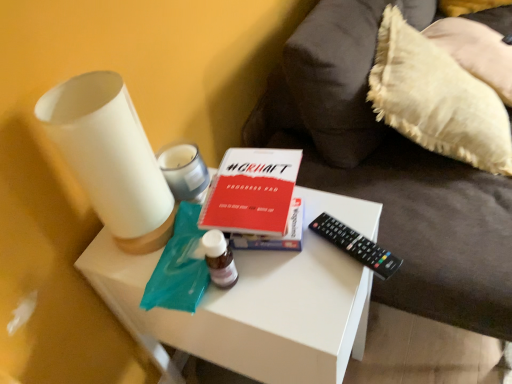
Question: Does white matte vase at left, the second candle holder positioned from the back, have a greater height compared to white fluffy pillow at right?

Choices:
 (A) no
 (B) yes

Answer: (A)

Question: Is white fluffy pillow at right at the back of white matte vase at left, the second candle holder positioned from the back?

Choices:
 (A) no
 (B) yes

Answer: (A)

Question: From a real-world perspective, is white matte vase at left, positioned as the first candle holder in front-to-back order, physically above white fluffy pillow at right?

Choices:
 (A) no
 (B) yes

Answer: (B)

Question: From the image's perspective, does white matte vase at left, the second candle holder positioned from the back, appear lower than white fluffy pillow at right?

Choices:
 (A) no
 (B) yes

Answer: (B)

Question: Is white fluffy pillow at right located within white matte vase at left, positioned as the first candle holder in front-to-back order?

Choices:
 (A) no
 (B) yes

Answer: (A)

Question: Looking at their shapes, would you say white matte table at center is wider or thinner than white fluffy pillow at right?

Choices:
 (A) wide
 (B) thin

Answer: (A)

Question: Does point (182, 339) appear closer or farther from the camera than point (467, 122)?

Choices:
 (A) farther
 (B) closer

Answer: (B)

Question: Is white matte table at center in front of or behind white fluffy pillow at right in the image?

Choices:
 (A) behind
 (B) front

Answer: (B)

Question: Do you think white matte table at center is within white fluffy pillow at right, or outside of it?

Choices:
 (A) outside
 (B) inside

Answer: (A)

Question: Do you think black plastic remote at right is within white matte side table at center, or outside of it?

Choices:
 (A) inside
 (B) outside

Answer: (B)

Question: Is black plastic remote at right in front of or behind white matte side table at center in the image?

Choices:
 (A) front
 (B) behind

Answer: (B)

Question: From the image's perspective, relative to white matte side table at center, is black plastic remote at right above or below?

Choices:
 (A) below
 (B) above

Answer: (A)

Question: Looking at their shapes, would you say black plastic remote at right is wider or thinner than white matte side table at center?

Choices:
 (A) thin
 (B) wide

Answer: (A)

Question: Based on their sizes in the image, would you say white glossy candle at upper center, marked as the first candle holder in a back-to-front arrangement, is bigger or smaller than white matte vase at left, positioned as the first candle holder in front-to-back order?

Choices:
 (A) small
 (B) big

Answer: (A)

Question: Is white glossy candle at upper center, the 2th candle holder in the front-to-back sequence, wider or thinner than white matte vase at left, positioned as the first candle holder in front-to-back order?

Choices:
 (A) wide
 (B) thin

Answer: (B)